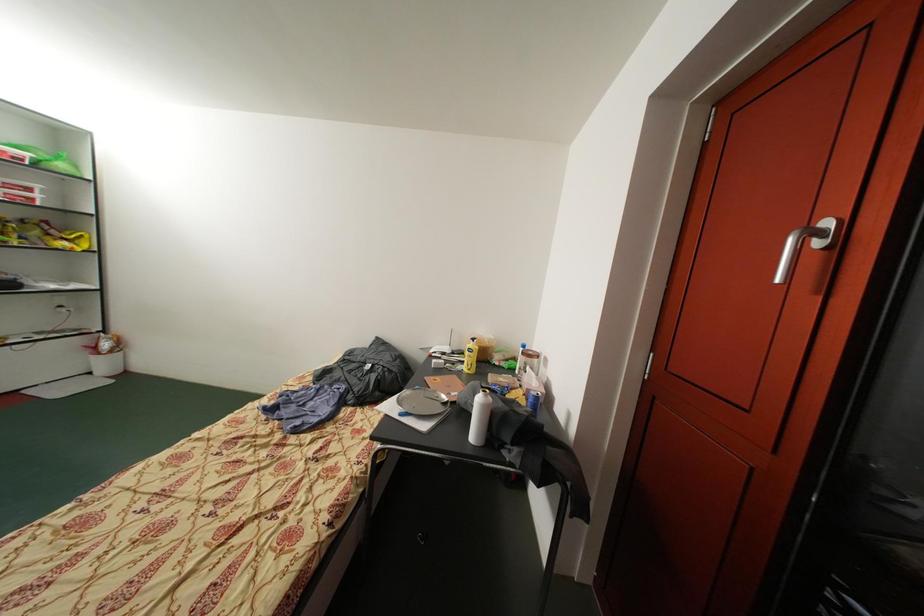
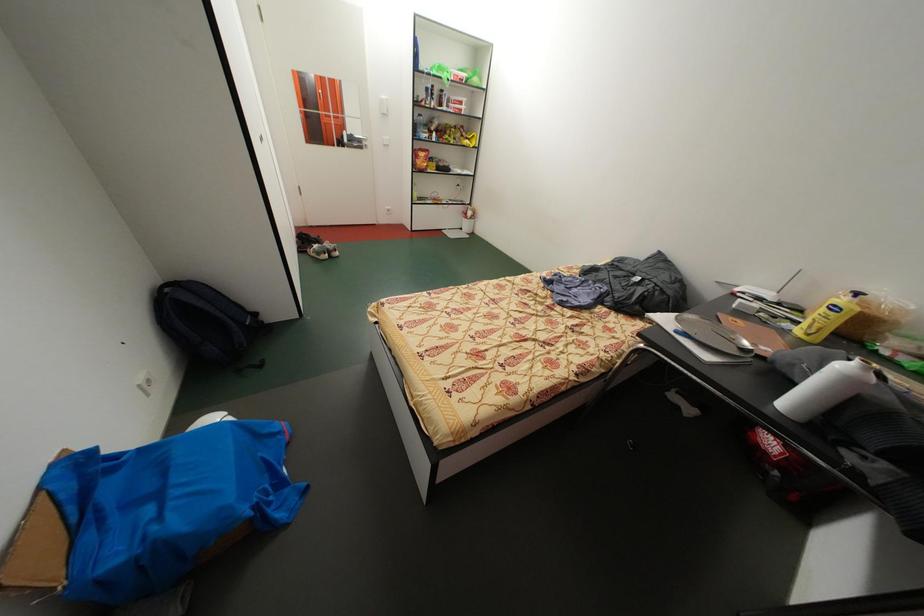
The first image is from the beginning of the video and the second image is from the end. How did the camera likely rotate when shooting the video?

The camera's rotation is toward left-down.